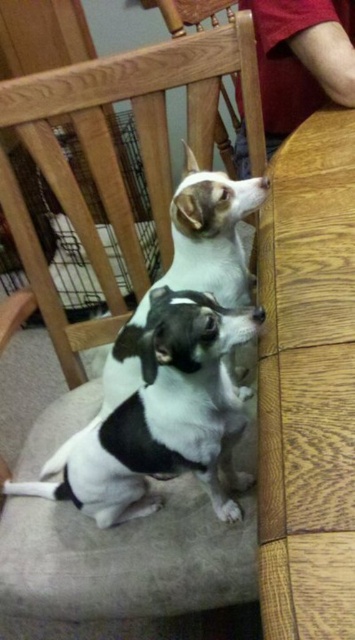
Question: Which of these objects is positioned farthest from the black and white fur dog at center?

Choices:
 (A) wooden table at right
 (B) wooden chair at center

Answer: (B)

Question: Which point is closer to the camera taking this photo?

Choices:
 (A) (199, 74)
 (B) (301, 346)

Answer: (B)

Question: Is wooden table at right wider than wooden chair at center?

Choices:
 (A) no
 (B) yes

Answer: (A)

Question: Does wooden table at right have a smaller size compared to wooden chair at center?

Choices:
 (A) yes
 (B) no

Answer: (A)

Question: Among these objects, which one is nearest to the camera?

Choices:
 (A) black and white fur dog at center
 (B) wooden chair at center
 (C) wooden table at right

Answer: (C)

Question: Can you confirm if wooden table at right is positioned above black and white fur dog at center?

Choices:
 (A) yes
 (B) no

Answer: (A)